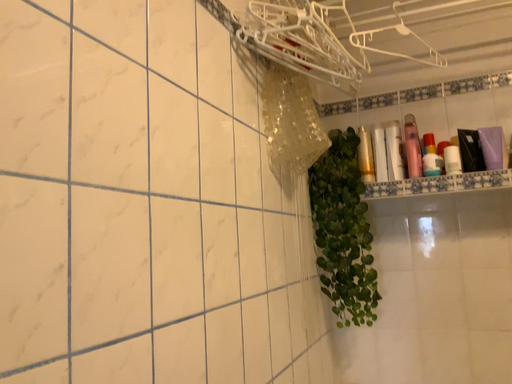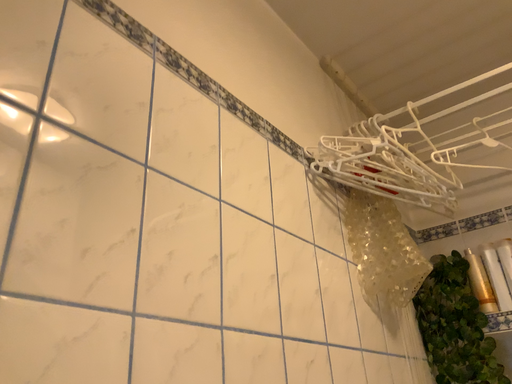
Question: Which way did the camera rotate in the video?

Choices:
 (A) rotated upward
 (B) rotated downward

Answer: (A)